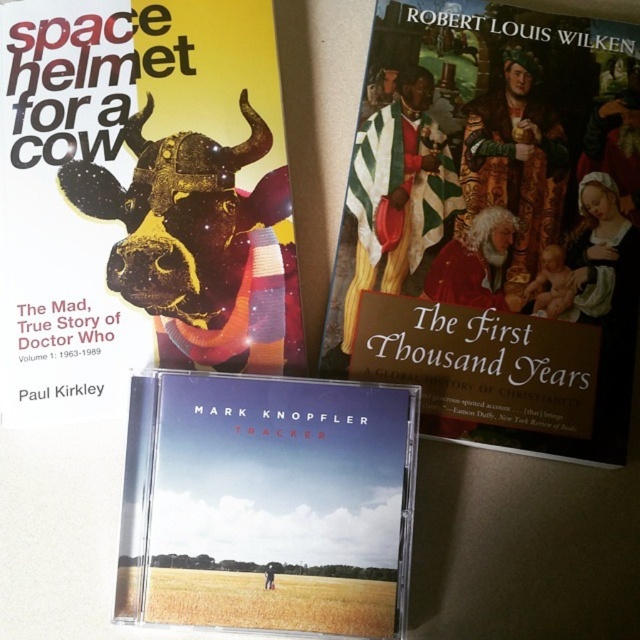
Is matte black book cover at left bigger than metallic gold bull at center?

Yes, matte black book cover at left is bigger than metallic gold bull at center.

Does matte black book cover at left have a lesser width compared to metallic gold bull at center?

In fact, matte black book cover at left might be wider than metallic gold bull at center.

Which is in front, point (250, 344) or point (61, 182)?

Point (61, 182)

Identify the location of matte black book cover at left. The image size is (640, 640). (140, 198).

Can you confirm if matte gold book at center is positioned to the left of matte black book cover at left?

Incorrect, matte gold book at center is not on the left side of matte black book cover at left.

Does matte gold book at center have a larger size compared to matte black book cover at left?

Yes, matte gold book at center is bigger than matte black book cover at left.

Is point (532, 182) less distant than point (58, 157)?

That is False.

The height and width of the screenshot is (640, 640). I want to click on matte gold book at center, so click(493, 225).

Can you confirm if matte cd case at center is smaller than metallic gold bull at center?

No, matte cd case at center is not smaller than metallic gold bull at center.

Is point (316, 410) positioned after point (160, 173)?

No.

Does point (150, 404) come in front of point (248, 154)?

Yes, it is.

Identify the location of matte cd case at center. This screenshot has height=640, width=640. (268, 504).